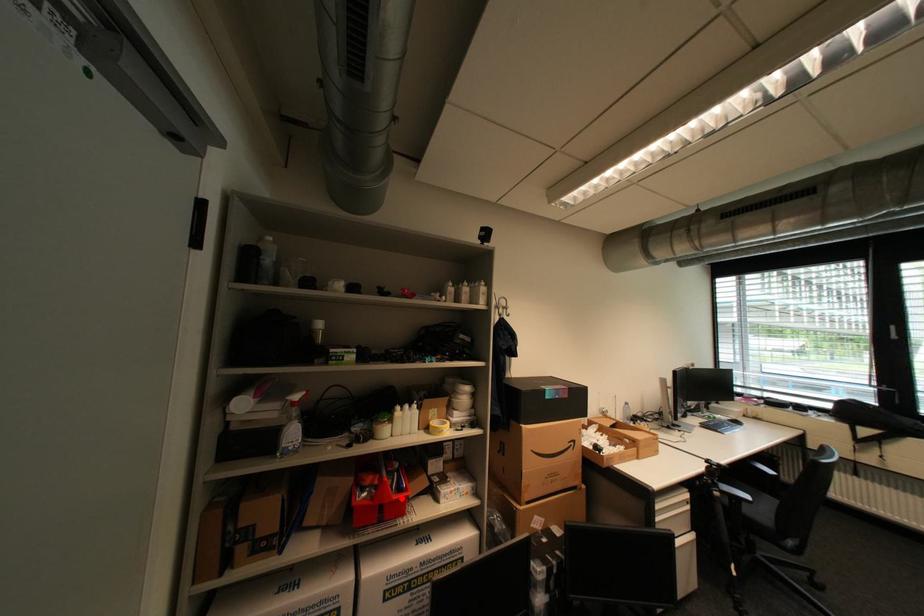
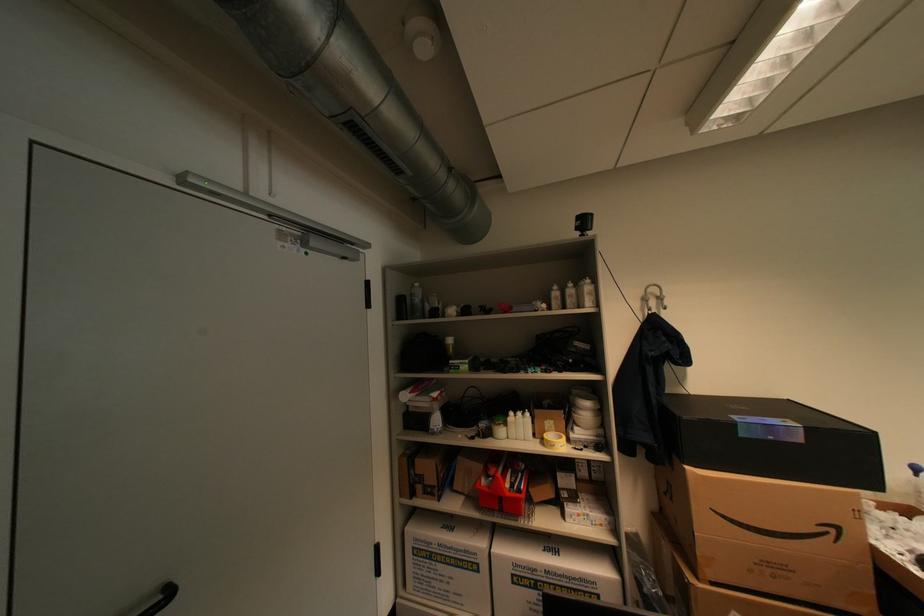
Find the pixel in the second image that matches the highlighted location in the first image.

(516, 495)